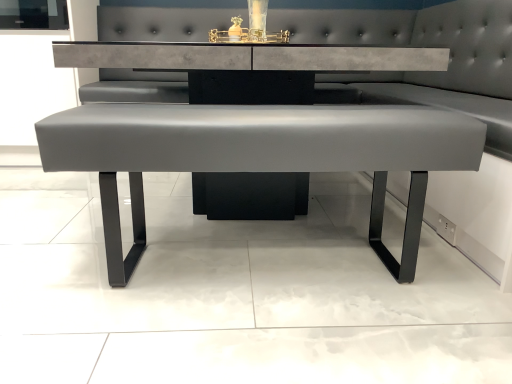
Where is `satin gray bench at center, the second table positioned from the back`? satin gray bench at center, the second table positioned from the back is located at coordinates (257, 155).

The height and width of the screenshot is (384, 512). What do you see at coordinates (257, 155) in the screenshot?
I see `satin gray bench at center, the second table positioned from the back` at bounding box center [257, 155].

From the picture: Measure the distance between point (277, 63) and camera.

Point (277, 63) and camera are 1.44 meters apart.

What is the approximate width of satin gray leather bench at center, positioned as the 2th table in front-to-back order?

1.35 meters.

Find the location of a particular element. satin gray leather bench at center, which ranks as the first table in back-to-front order is located at coordinates (247, 57).

What do you see at coordinates (247, 57) in the screenshot? This screenshot has width=512, height=384. I see `satin gray leather bench at center, which ranks as the first table in back-to-front order` at bounding box center [247, 57].

This screenshot has height=384, width=512. Find the location of `satin gray bench at center, which is the 1th table from front to back`. satin gray bench at center, which is the 1th table from front to back is located at coordinates (257, 155).

Considering the relative positions of satin gray leather bench at center, which ranks as the first table in back-to-front order, and satin gray bench at center, which is the 1th table from front to back, in the image provided, is satin gray leather bench at center, which ranks as the first table in back-to-front order, to the right of satin gray bench at center, which is the 1th table from front to back, from the viewer's perspective?

In fact, satin gray leather bench at center, which ranks as the first table in back-to-front order, is to the left of satin gray bench at center, which is the 1th table from front to back.

Which object is more forward, satin gray leather bench at center, which ranks as the first table in back-to-front order, or satin gray bench at center, which is the 1th table from front to back?

satin gray bench at center, which is the 1th table from front to back.

Based on the photo, which point is more forward, (192,49) or (305,115)?

The point (305,115) is in front.

From the image's perspective, relative to satin gray bench at center, which is the 1th table from front to back, is satin gray leather bench at center, which ranks as the first table in back-to-front order, above or below?

Clearly, from the image's perspective, satin gray leather bench at center, which ranks as the first table in back-to-front order, is above satin gray bench at center, which is the 1th table from front to back.

From a real-world perspective, which object stands above the other?

satin gray leather bench at center, which ranks as the first table in back-to-front order.

Can you confirm if satin gray leather bench at center, which ranks as the first table in back-to-front order, is thinner than satin gray bench at center, the second table positioned from the back?

No.

From their relative heights in the image, would you say satin gray leather bench at center, which ranks as the first table in back-to-front order, is taller or shorter than satin gray bench at center, the second table positioned from the back?

In the image, satin gray leather bench at center, which ranks as the first table in back-to-front order, appears to be taller than satin gray bench at center, the second table positioned from the back.

Who is smaller, satin gray leather bench at center, which ranks as the first table in back-to-front order, or satin gray bench at center, which is the 1th table from front to back?

satin gray bench at center, which is the 1th table from front to back, is smaller.

Choose the correct answer: Is satin gray leather bench at center, which ranks as the first table in back-to-front order, inside satin gray bench at center, the second table positioned from the back, or outside it?

The correct answer is: outside.

Are satin gray leather bench at center, which ranks as the first table in back-to-front order, and satin gray bench at center, the second table positioned from the back, located far from each other?

Actually, satin gray leather bench at center, which ranks as the first table in back-to-front order, and satin gray bench at center, the second table positioned from the back, are a little close together.

Is satin gray leather bench at center, positioned as the 2th table in front-to-back order, aimed at satin gray bench at center, the second table positioned from the back?

Yes, satin gray leather bench at center, positioned as the 2th table in front-to-back order, is facing satin gray bench at center, the second table positioned from the back.

Can you tell me how much satin gray leather bench at center, positioned as the 2th table in front-to-back order, and satin gray bench at center, which is the 1th table from front to back, differ in facing direction?

180 degrees.

Find the location of a particular element. Image resolution: width=512 pixels, height=384 pixels. table on the left side of satin gray bench at center, the second table positioned from the back is located at coordinates (247, 57).

Can you confirm if satin gray bench at center, which is the 1th table from front to back, is positioned to the left of satin gray leather bench at center, which ranks as the first table in back-to-front order?

Incorrect, satin gray bench at center, which is the 1th table from front to back, is not on the left side of satin gray leather bench at center, which ranks as the first table in back-to-front order.

Consider the image. Considering the positions of objects satin gray bench at center, the second table positioned from the back, and satin gray leather bench at center, which ranks as the first table in back-to-front order, in the image provided, who is behind, satin gray bench at center, the second table positioned from the back, or satin gray leather bench at center, which ranks as the first table in back-to-front order,?

satin gray leather bench at center, which ranks as the first table in back-to-front order, is further away from the camera.

Which is behind, point (248, 137) or point (142, 52)?

Positioned behind is point (142, 52).

From the image's perspective, is satin gray bench at center, the second table positioned from the back, located above or below satin gray leather bench at center, which ranks as the first table in back-to-front order?

From the image's perspective, satin gray bench at center, the second table positioned from the back, appears below satin gray leather bench at center, which ranks as the first table in back-to-front order.

From the picture: From a real-world perspective, which is physically above, satin gray bench at center, the second table positioned from the back, or satin gray leather bench at center, which ranks as the first table in back-to-front order?

In real-world perspective, satin gray leather bench at center, which ranks as the first table in back-to-front order, is above.

Which object is wider, satin gray bench at center, the second table positioned from the back, or satin gray leather bench at center, which ranks as the first table in back-to-front order?

With larger width is satin gray leather bench at center, which ranks as the first table in back-to-front order.

Who is shorter, satin gray bench at center, the second table positioned from the back, or satin gray leather bench at center, positioned as the 2th table in front-to-back order?

satin gray bench at center, the second table positioned from the back.

Between satin gray bench at center, the second table positioned from the back, and satin gray leather bench at center, which ranks as the first table in back-to-front order, which one has smaller size?

satin gray bench at center, the second table positioned from the back, is smaller.

Is satin gray leather bench at center, positioned as the 2th table in front-to-back order, inside satin gray bench at center, which is the 1th table from front to back?

No, satin gray leather bench at center, positioned as the 2th table in front-to-back order, is not inside satin gray bench at center, which is the 1th table from front to back.

Is satin gray bench at center, which is the 1th table from front to back, beside satin gray leather bench at center, which ranks as the first table in back-to-front order?

No.

Is satin gray bench at center, which is the 1th table from front to back, looking in the opposite direction of satin gray leather bench at center, positioned as the 2th table in front-to-back order?

No, satin gray bench at center, which is the 1th table from front to back, is not facing away from satin gray leather bench at center, positioned as the 2th table in front-to-back order.

What's the angular difference between satin gray bench at center, which is the 1th table from front to back, and satin gray leather bench at center, which ranks as the first table in back-to-front order,'s facing directions?

They differ by 180 degrees in their facing directions.

Could you measure the distance between satin gray bench at center, the second table positioned from the back, and satin gray leather bench at center, positioned as the 2th table in front-to-back order?

12.04 inches.

Where is `table behind the satin gray bench at center, which is the 1th table from front to back`? The height and width of the screenshot is (384, 512). table behind the satin gray bench at center, which is the 1th table from front to back is located at coordinates (247, 57).

Locate an element on the screen. Image resolution: width=512 pixels, height=384 pixels. table behind the satin gray bench at center, which is the 1th table from front to back is located at coordinates (247, 57).

You are a GUI agent. You are given a task and a screenshot of the screen. Output one action in this format:
    pyautogui.click(x=<x>, y=<y>)
    Task: Click on the table located underneath the satin gray leather bench at center, which ranks as the first table in back-to-front order (from a real-world perspective)
    This screenshot has height=384, width=512.
    Given the screenshot: What is the action you would take?
    pyautogui.click(x=257, y=155)